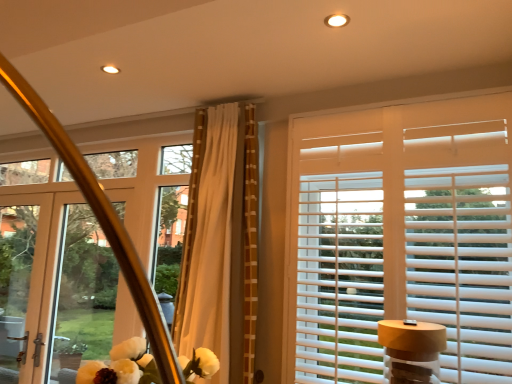
Question: Can you confirm if white wood blinds at upper right is thinner than beige textured curtain at center?

Choices:
 (A) no
 (B) yes

Answer: (B)

Question: Considering the relative sizes of white wood blinds at upper right and beige textured curtain at center in the image provided, is white wood blinds at upper right wider than beige textured curtain at center?

Choices:
 (A) yes
 (B) no

Answer: (B)

Question: Is white wood blinds at upper right beside beige textured curtain at center?

Choices:
 (A) no
 (B) yes

Answer: (A)

Question: From a real-world perspective, is white wood blinds at upper right positioned under beige textured curtain at center based on gravity?

Choices:
 (A) yes
 (B) no

Answer: (A)

Question: Is white wood blinds at upper right facing towards beige textured curtain at center?

Choices:
 (A) yes
 (B) no

Answer: (B)

Question: From the image's perspective, is white wood blinds at upper right positioned above or below beige textured curtain at center?

Choices:
 (A) above
 (B) below

Answer: (B)

Question: From a real-world perspective, is white wood blinds at upper right positioned above or below beige textured curtain at center?

Choices:
 (A) above
 (B) below

Answer: (B)

Question: Based on their positions, is white wood blinds at upper right located to the left or right of beige textured curtain at center?

Choices:
 (A) left
 (B) right

Answer: (B)

Question: Considering the positions of white wood blinds at upper right and beige textured curtain at center in the image, is white wood blinds at upper right wider or thinner than beige textured curtain at center?

Choices:
 (A) wide
 (B) thin

Answer: (B)

Question: Is clear glass screen door at left to the left or to the right of matte white door at left in the image?

Choices:
 (A) left
 (B) right

Answer: (A)

Question: In terms of width, does clear glass screen door at left look wider or thinner when compared to matte white door at left?

Choices:
 (A) thin
 (B) wide

Answer: (A)

Question: Looking at the image, does clear glass screen door at left seem bigger or smaller compared to matte white door at left?

Choices:
 (A) big
 (B) small

Answer: (B)

Question: Is point (11, 304) positioned closer to the camera than point (88, 248)?

Choices:
 (A) farther
 (B) closer

Answer: (B)

Question: Considering their positions, is beige textured curtain at center located in front of or behind white wood blinds at upper right?

Choices:
 (A) front
 (B) behind

Answer: (B)

Question: In terms of height, does beige textured curtain at center look taller or shorter compared to white wood blinds at upper right?

Choices:
 (A) tall
 (B) short

Answer: (B)